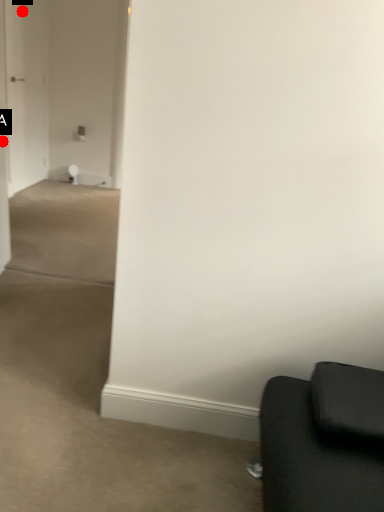
Question: Two points are circled on the image, labeled by A and B beside each circle. Among these points, which one is farthest from the camera?

Choices:
 (A) A is further
 (B) B is further

Answer: (B)